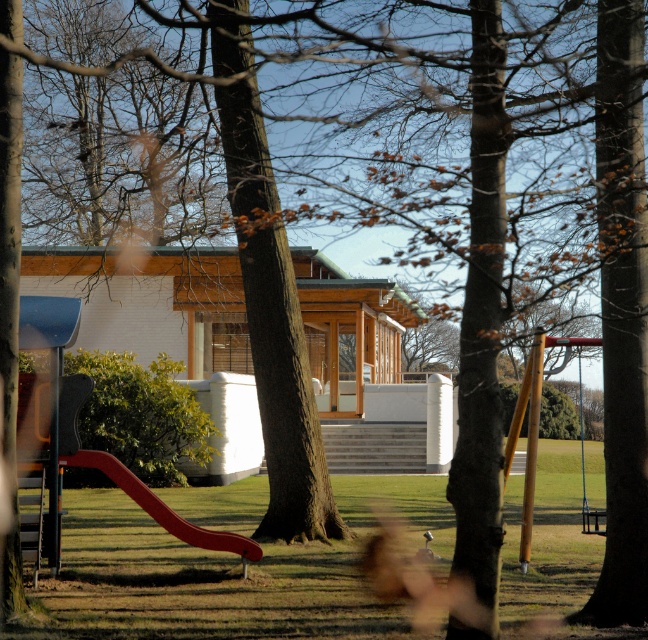
Question: Which point appears closest to the camera in this image?

Choices:
 (A) (581, 424)
 (B) (141, 493)

Answer: (B)

Question: Is red plastic slide at lower left bigger than metallic silver swing at right?

Choices:
 (A) yes
 (B) no

Answer: (B)

Question: Is red plastic slide at lower left thinner than metallic silver swing at right?

Choices:
 (A) yes
 (B) no

Answer: (A)

Question: Is red plastic slide at lower left above metallic silver swing at right?

Choices:
 (A) no
 (B) yes

Answer: (B)